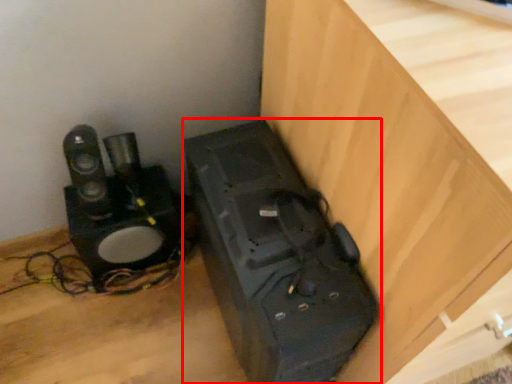
Question: Observing the image, what is the correct spatial positioning of appliance (annotated by the red box) in reference to furniture?

Choices:
 (A) right
 (B) left

Answer: (B)